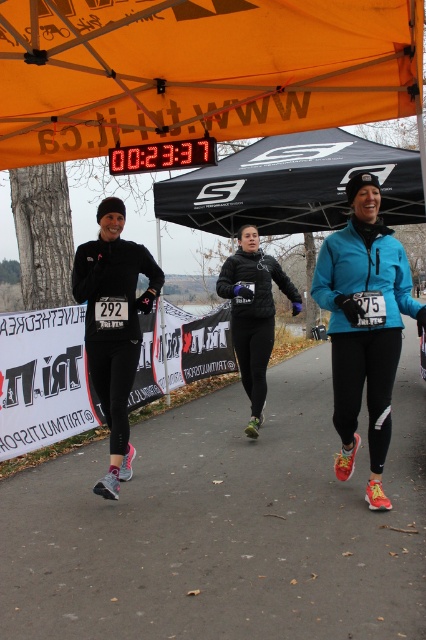
Question: Which of the following is the farthest from the observer?

Choices:
 (A) orange fabric canopy at upper center
 (B) matte blue jacket at center
 (C) black matte running shoes at lower center

Answer: (C)

Question: Does black fabric canopy at upper center appear over matte blue jacket at center?

Choices:
 (A) yes
 (B) no

Answer: (A)

Question: Which point is closer to the camera taking this photo?

Choices:
 (A) (367, 381)
 (B) (0, 138)
 (C) (267, 604)
 (D) (173, 220)

Answer: (C)

Question: Which point is farther to the camera?

Choices:
 (A) black quilted jacket at center
 (B) matte black running shoe at center
 (C) black matte running shoes at lower center

Answer: (A)

Question: Is black fabric canopy at upper center to the left of black quilted jacket at center from the viewer's perspective?

Choices:
 (A) no
 (B) yes

Answer: (A)

Question: Does black matte running shoes at lower center lie behind matte black running shoe at center?

Choices:
 (A) yes
 (B) no

Answer: (A)